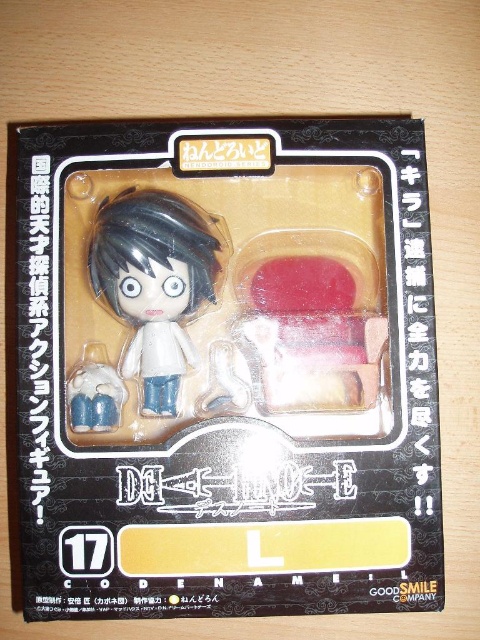
Which of these two, matte white doll at center or matte white figure at lower left, stands shorter?

With less height is matte white figure at lower left.

Is point (189, 349) in front of point (78, 400)?

No, (189, 349) is behind (78, 400).

Who is more distant from viewer, (212, 218) or (74, 406)?

The point (212, 218) is more distant.

Where is `matte white doll at center`? This screenshot has height=640, width=480. matte white doll at center is located at coordinates pos(155,282).

Which is more to the left, matte black action figure at center or matte white figure at lower left?

Positioned to the left is matte white figure at lower left.

Can you confirm if matte black action figure at center is smaller than matte white figure at lower left?

No.

Between point (206, 237) and point (82, 358), which one is positioned behind?

Positioned behind is point (206, 237).

At what (x,y) coordinates should I click in order to perform the action: click on matte black action figure at center. Please return your answer as a coordinate pair (x, y). This screenshot has height=640, width=480. Looking at the image, I should click on (228, 369).

Looking at this image, does matte black action figure at center have a lesser height compared to matte white doll at center?

Incorrect, matte black action figure at center's height does not fall short of matte white doll at center's.

Which is more to the right, matte black action figure at center or matte white doll at center?

matte black action figure at center

The height and width of the screenshot is (640, 480). In order to click on matte black action figure at center in this screenshot , I will do `click(228, 369)`.